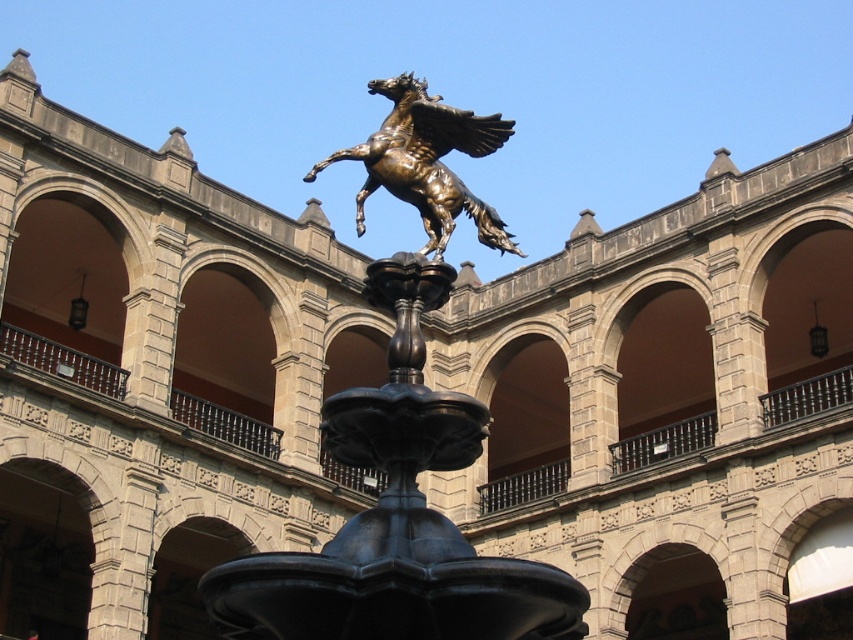
Question: Is black polished fountain at center to the right of bronze/statue at center from the viewer's perspective?

Choices:
 (A) no
 (B) yes

Answer: (A)

Question: Is black polished fountain at center below bronze/statue at center?

Choices:
 (A) no
 (B) yes

Answer: (B)

Question: Which of the following is the farthest from the observer?

Choices:
 (A) bronze/statue at center
 (B) black polished fountain at center

Answer: (A)

Question: Based on their relative distances, which object is nearer to the brown stone archway at center?

Choices:
 (A) bronze/statue at center
 (B) black polished fountain at center

Answer: (B)

Question: Which object is positioned farthest from the brown stone archway at center?

Choices:
 (A) black polished fountain at center
 (B) bronze/statue at center

Answer: (B)

Question: Does bronze/statue at center have a greater width compared to brown stone archway at center?

Choices:
 (A) no
 (B) yes

Answer: (A)